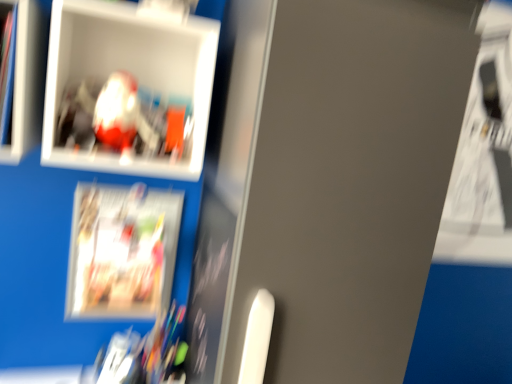
Image resolution: width=512 pixels, height=384 pixels. Describe the element at coordinates (26, 83) in the screenshot. I see `white plastic cabinet at upper left` at that location.

The height and width of the screenshot is (384, 512). What are the coordinates of `matte paper magazine at lower left` in the screenshot? It's located at (122, 251).

Locate an element on the screen. Image resolution: width=512 pixels, height=384 pixels. white plastic cabinet at upper left is located at coordinates [x=26, y=83].

In order to click on cabinet below the matte plastic picture frame at upper left (from a real-world perspective) in this screenshot , I will do `click(26, 83)`.

Between white plastic cabinet at upper left and matte plastic picture frame at upper left, which one is positioned behind?

matte plastic picture frame at upper left is behind.

Does point (38, 85) come behind point (116, 17)?

Yes, point (38, 85) is behind point (116, 17).

Looking at this image, which is correct: white plastic cabinet at upper left is inside matte plastic picture frame at upper left, or outside of it?

white plastic cabinet at upper left lies outside matte plastic picture frame at upper left.

Would you say matte plastic picture frame at upper left is a long distance from white plastic cabinet at upper left?

That's not correct — matte plastic picture frame at upper left is a little close to white plastic cabinet at upper left.

From the image's perspective, is matte plastic picture frame at upper left on white plastic cabinet at upper left?

No.

Which object is positioned more to the left, matte plastic picture frame at upper left or white plastic cabinet at upper left?

Positioned to the left is white plastic cabinet at upper left.

From the image's perspective, would you say white plastic cabinet at upper left is positioned over matte paper magazine at lower left?

Yes, from the image's perspective, white plastic cabinet at upper left is over matte paper magazine at lower left.

Is white plastic cabinet at upper left not inside matte paper magazine at lower left?

Yes, white plastic cabinet at upper left is not within matte paper magazine at lower left.

Looking at this image, is white plastic cabinet at upper left to the right of matte paper magazine at lower left from the viewer's perspective?

No, white plastic cabinet at upper left is not to the right of matte paper magazine at lower left.

Between point (41, 44) and point (106, 292), which one is positioned in front?

Point (41, 44)

How many degrees apart are the facing directions of matte paper magazine at lower left and white plastic cabinet at upper left?

They differ by 0.958 degrees in their facing directions.

Considering the positions of objects matte paper magazine at lower left and white plastic cabinet at upper left in the image provided, who is more to the right, matte paper magazine at lower left or white plastic cabinet at upper left?

Positioned to the right is matte paper magazine at lower left.

Which object is wider, matte paper magazine at lower left or white plastic cabinet at upper left?

white plastic cabinet at upper left is wider.

Can you confirm if matte paper magazine at lower left is shorter than white plastic cabinet at upper left?

In fact, matte paper magazine at lower left may be taller than white plastic cabinet at upper left.

Can we say matte plastic picture frame at upper left lies outside matte paper magazine at lower left?

Yes, matte plastic picture frame at upper left is not within matte paper magazine at lower left.

From the image's perspective, is matte plastic picture frame at upper left above matte paper magazine at lower left?

Indeed, from the image's perspective, matte plastic picture frame at upper left is shown above matte paper magazine at lower left.

Is matte plastic picture frame at upper left positioned with its back to matte paper magazine at lower left?

No.

Is matte paper magazine at lower left behind matte plastic picture frame at upper left?

Yes, matte paper magazine at lower left is further from the viewer.

Are matte paper magazine at lower left and matte plastic picture frame at upper left located far from each other?

That's not correct — matte paper magazine at lower left is a little close to matte plastic picture frame at upper left.

From a real-world perspective, is matte paper magazine at lower left on top of matte plastic picture frame at upper left?

No, from a real-world perspective, matte paper magazine at lower left is not above matte plastic picture frame at upper left.

In the image, is matte paper magazine at lower left on the left side or the right side of matte plastic picture frame at upper left?

Clearly, matte paper magazine at lower left is on the left of matte plastic picture frame at upper left in the image.

Where is `cabinet that is above the matte plastic picture frame at upper left (from the image's perspective)`? cabinet that is above the matte plastic picture frame at upper left (from the image's perspective) is located at coordinates (26, 83).

Image resolution: width=512 pixels, height=384 pixels. What are the coordinates of `cabinet located underneath the matte plastic picture frame at upper left (from a real-world perspective)` in the screenshot? It's located at pos(26,83).

Based on their spatial positions, is matte paper magazine at lower left or matte plastic picture frame at upper left closer to white plastic cabinet at upper left?

matte plastic picture frame at upper left is closer to white plastic cabinet at upper left.

Based on their spatial positions, is matte plastic picture frame at upper left or white plastic cabinet at upper left closer to matte paper magazine at lower left?

The object closer to matte paper magazine at lower left is matte plastic picture frame at upper left.

Looking at the image, which one is located closer to matte plastic picture frame at upper left, matte paper magazine at lower left or white plastic cabinet at upper left?

Among the two, white plastic cabinet at upper left is located nearer to matte plastic picture frame at upper left.

Considering their positions, is white plastic cabinet at upper left positioned closer to matte paper magazine at lower left than matte plastic picture frame at upper left?

Among the two, matte plastic picture frame at upper left is located nearer to matte paper magazine at lower left.

Considering their positions, is white plastic cabinet at upper left positioned further to matte plastic picture frame at upper left than matte paper magazine at lower left?

matte paper magazine at lower left lies further to matte plastic picture frame at upper left than the other object.

Looking at the image, which one is located further to white plastic cabinet at upper left, matte plastic picture frame at upper left or matte paper magazine at lower left?

matte paper magazine at lower left is positioned further to the anchor white plastic cabinet at upper left.

At what (x,y) coordinates should I click in order to perform the action: click on picture frame between white plastic cabinet at upper left and matte paper magazine at lower left in the vertical direction. Please return your answer as a coordinate pair (x, y). The width and height of the screenshot is (512, 384). Looking at the image, I should click on (132, 91).